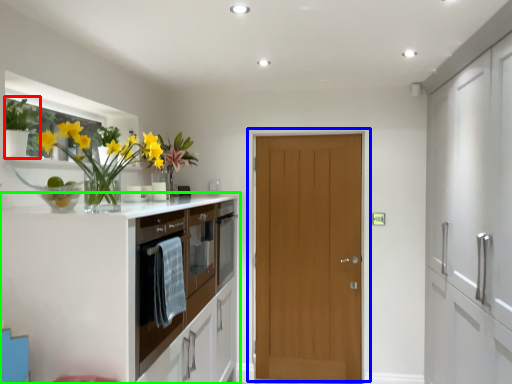
Question: Which object is the farthest from plant (highlighted by a red box)? Choose among these: door (highlighted by a blue box) or cabinetry (highlighted by a green box).

Choices:
 (A) door
 (B) cabinetry

Answer: (A)